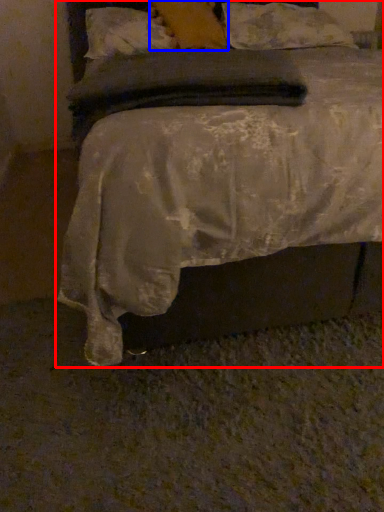
Question: Which of the following is the farthest to the observer, bed (highlighted by a red box) or pillow (highlighted by a blue box)?

Choices:
 (A) bed
 (B) pillow

Answer: (B)